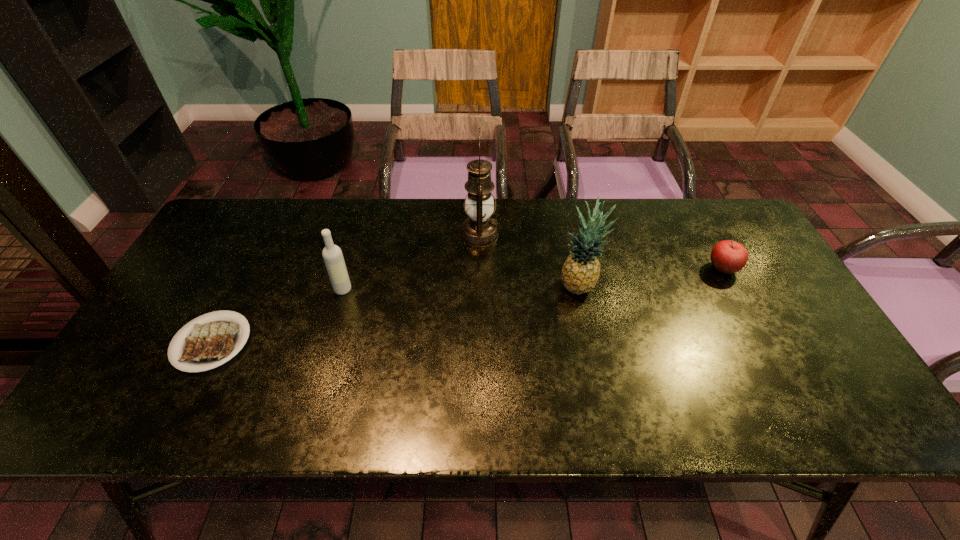
I want to click on oil lamp, so click(x=479, y=230).

At what (x,y) coordinates should I click in order to perform the action: click on the third object from right to left. Please return your answer as a coordinate pair (x, y). Image resolution: width=960 pixels, height=540 pixels. Looking at the image, I should click on (x=479, y=230).

This screenshot has width=960, height=540. What are the coordinates of `the second object from right to left` in the screenshot? It's located at (580, 273).

The width and height of the screenshot is (960, 540). What are the coordinates of `the second tallest object` in the screenshot? It's located at (580, 273).

Where is `the third tallest object`? The image size is (960, 540). the third tallest object is located at coordinates (333, 258).

The height and width of the screenshot is (540, 960). In order to click on vodka in this screenshot , I will do tap(333, 258).

Where is `the fourth tallest object`? the fourth tallest object is located at coordinates (728, 256).

The image size is (960, 540). I want to click on the rightmost object, so click(x=728, y=256).

Identify the location of the leftmost object. (211, 343).

Locate an element on the screen. plate is located at coordinates (211, 343).